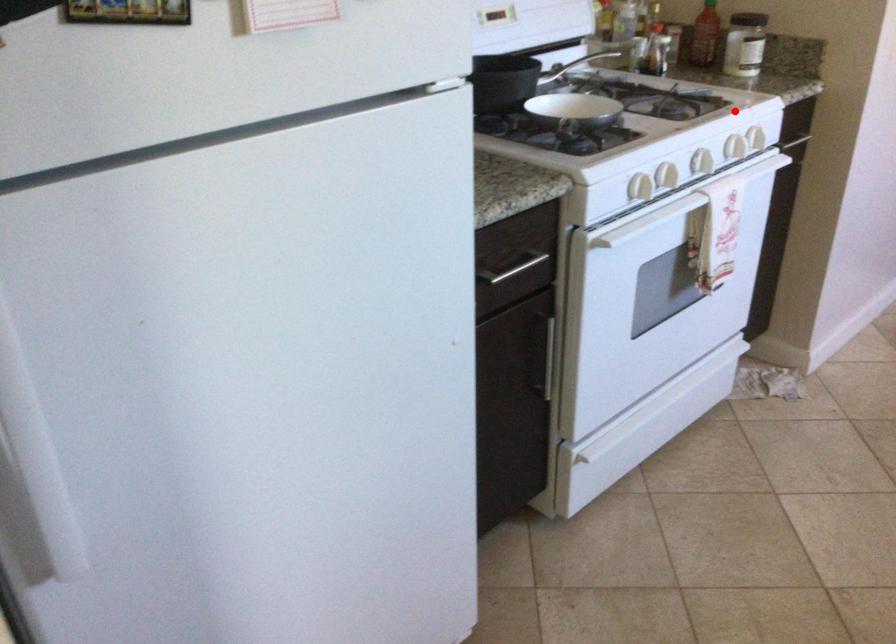
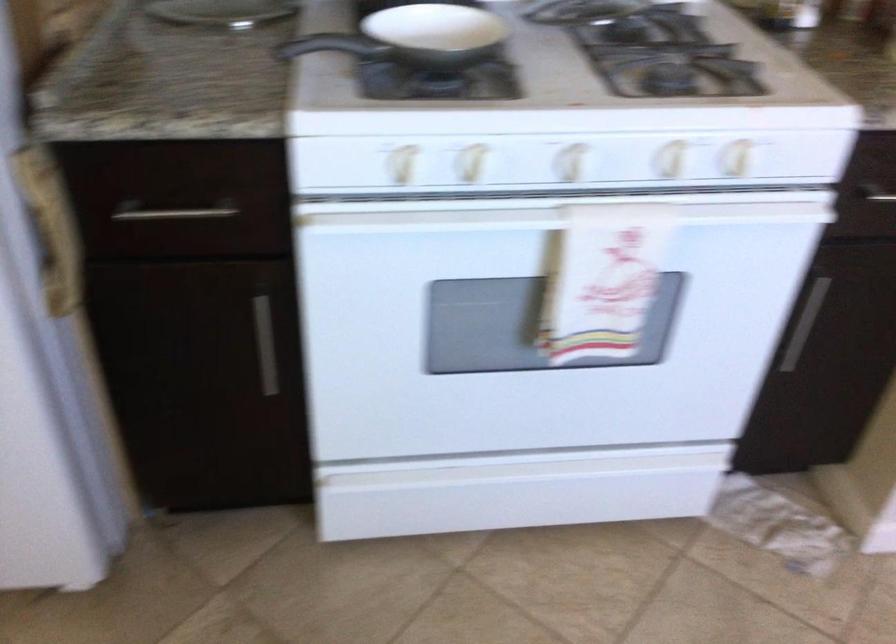
The point at the highlighted location is marked in the first image. Where is the corresponding point in the second image?

(670, 158)